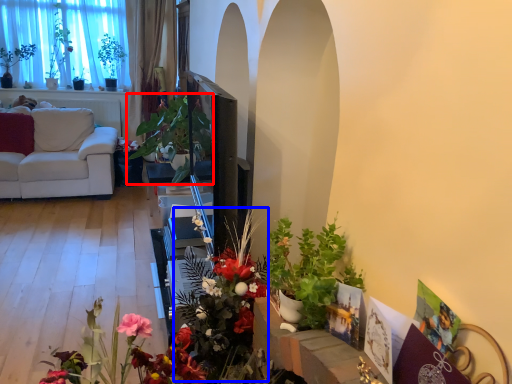
Question: Which point is closer to the camera, houseplant (highlighted by a red box) or floral arrangement (highlighted by a blue box)?

Choices:
 (A) houseplant
 (B) floral arrangement

Answer: (B)